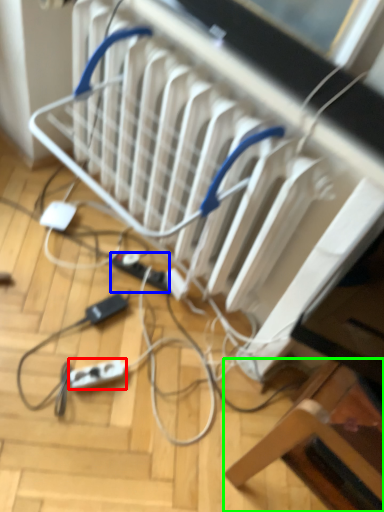
Question: Based on their relative distances, which object is farther from extension cord (highlighted by a red box)? Choose from extension cord (highlighted by a blue box) and furniture (highlighted by a green box).

Choices:
 (A) extension cord
 (B) furniture

Answer: (B)